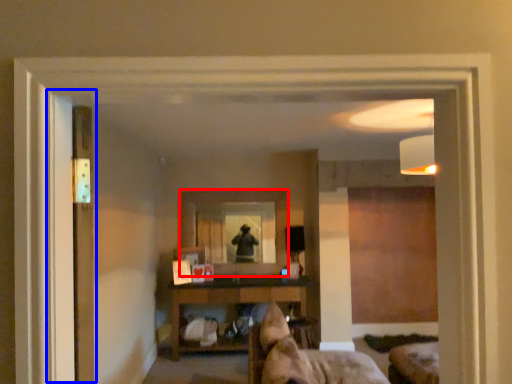
Question: Which object is further to the camera taking this photo, mirror (highlighted by a red box) or screen door (highlighted by a blue box)?

Choices:
 (A) mirror
 (B) screen door

Answer: (A)